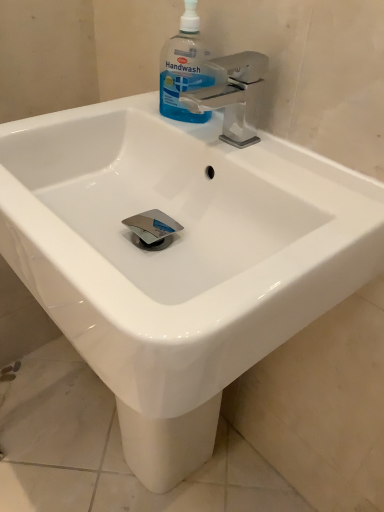
Describe the element at coordinates (184, 68) in the screenshot. I see `transparent plastic handwash at upper center` at that location.

This screenshot has height=512, width=384. What are the coordinates of `transparent plastic handwash at upper center` in the screenshot? It's located at (184, 68).

You are a GUI agent. You are given a task and a screenshot of the screen. Output one action in this format:
    pyautogui.click(x=<x>, y=<y>)
    Task: Click on the transparent plastic handwash at upper center
    Image resolution: width=384 pixels, height=512 pixels.
    Given the screenshot: What is the action you would take?
    pyautogui.click(x=184, y=68)